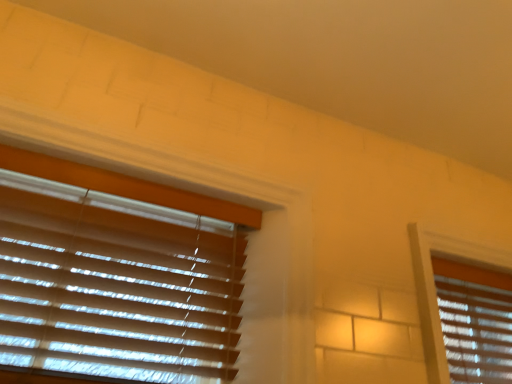
Question: Considering the positions of point (50, 193) and point (464, 286), is point (50, 193) closer or farther from the camera than point (464, 286)?

Choices:
 (A) farther
 (B) closer

Answer: (B)

Question: Based on their positions, is wooden blinds at left, the 2th window blind when ordered from right to left, located to the left or right of wooden blinds at right, the first window blind viewed from the back?

Choices:
 (A) left
 (B) right

Answer: (A)

Question: Considering the positions of wooden blinds at left, the 2th window blind when ordered from right to left, and wooden blinds at right, the first window blind viewed from the back, in the image, is wooden blinds at left, the 2th window blind when ordered from right to left, wider or thinner than wooden blinds at right, the first window blind viewed from the back,?

Choices:
 (A) wide
 (B) thin

Answer: (B)

Question: Is wooden blinds at right, the first window blind viewed from the back, situated inside wooden blinds at left, positioned as the 1th window blind in left-to-right order, or outside?

Choices:
 (A) inside
 (B) outside

Answer: (B)

Question: Looking at their shapes, would you say wooden blinds at right, which is the 1th window blind in right-to-left order, is wider or thinner than wooden blinds at left, which appears as the 1th window blind when viewed from the front?

Choices:
 (A) thin
 (B) wide

Answer: (B)

Question: Is point (506, 337) positioned closer to the camera than point (159, 382)?

Choices:
 (A) farther
 (B) closer

Answer: (A)

Question: From a real-world perspective, is wooden blinds at right, the 2th window blind when ordered from left to right, physically located above or below wooden blinds at left, which appears as the 1th window blind when viewed from the front?

Choices:
 (A) above
 (B) below

Answer: (A)